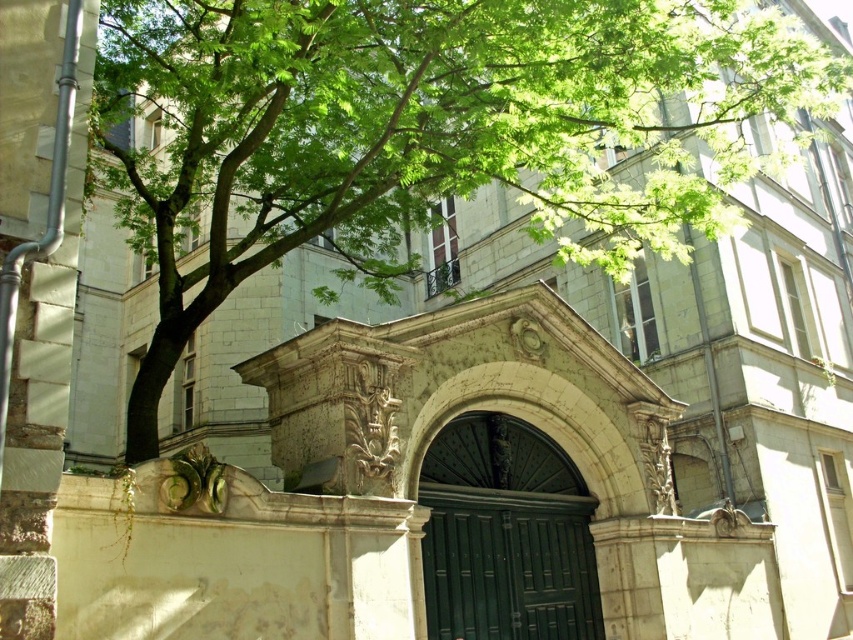
Question: Does green leafy tree at center have a greater width compared to green polished wood door at center?

Choices:
 (A) yes
 (B) no

Answer: (A)

Question: Which object appears farthest from the camera in this image?

Choices:
 (A) green leafy tree at center
 (B) green polished wood door at center

Answer: (B)

Question: Does green leafy tree at center have a greater width compared to green polished wood door at center?

Choices:
 (A) yes
 (B) no

Answer: (A)

Question: Is green leafy tree at center positioned behind green polished wood door at center?

Choices:
 (A) yes
 (B) no

Answer: (B)